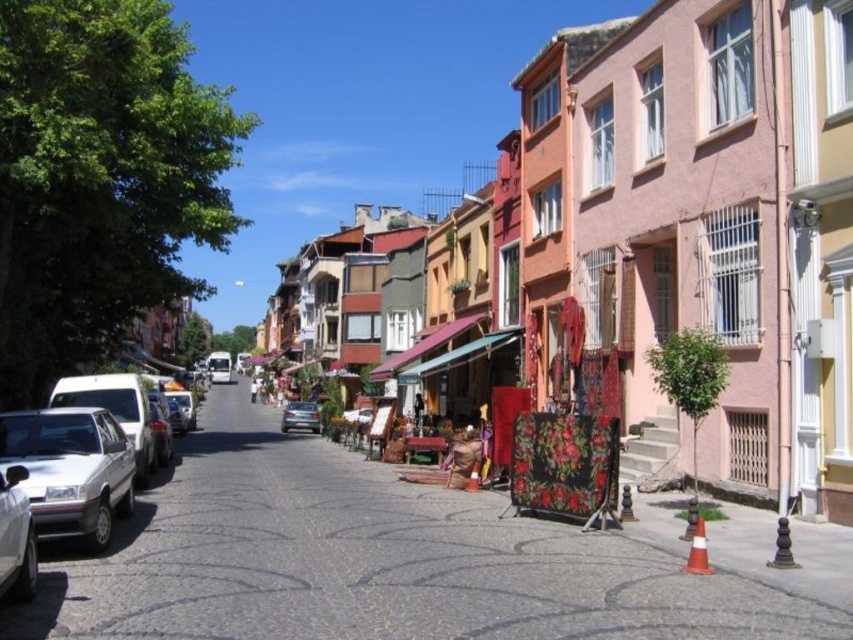
Question: Which point is closer to the camera?

Choices:
 (A) satin silver sedan at center
 (B) silver metallic car at lower left

Answer: (B)

Question: Among these objects, which one is nearest to the camera?

Choices:
 (A) satin silver sedan at center
 (B) silver metallic car at left
 (C) floral-patterned fabric at center

Answer: (B)

Question: Where is silver metallic car at lower left located in relation to floral fabric stall at center in the image?

Choices:
 (A) above
 (B) below

Answer: (B)

Question: Is floral-patterned fabric at center to the right of silver metallic car at lower left from the viewer's perspective?

Choices:
 (A) yes
 (B) no

Answer: (A)

Question: Is silver metallic car at left below floral fabric stall at center?

Choices:
 (A) yes
 (B) no

Answer: (A)

Question: Among these points, which one is farthest from the camera?

Choices:
 (A) (315, 406)
 (B) (793, 148)
 (C) (134, 374)
 (D) (415, 358)

Answer: (A)